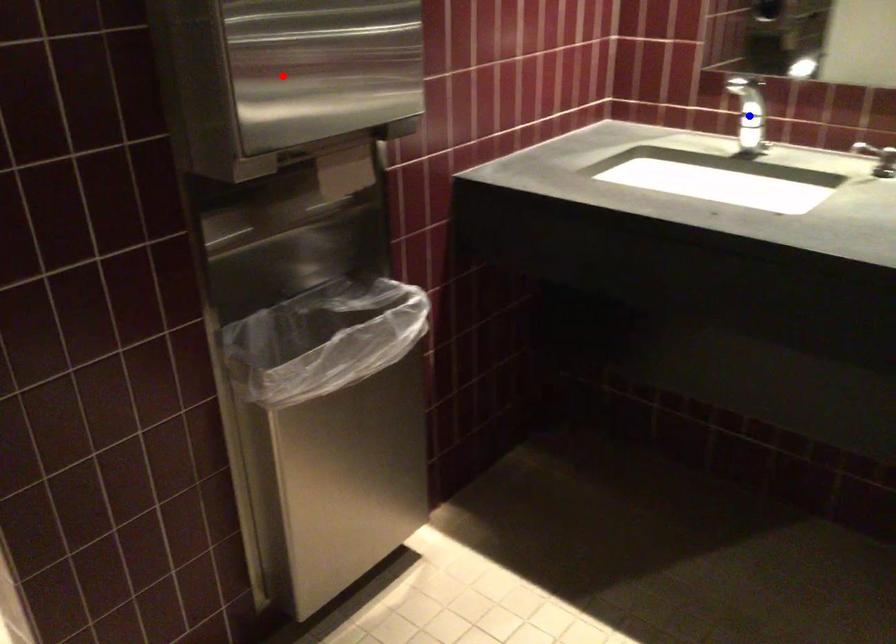
Question: In the image, two points are highlighted. Which point is nearer to the camera? Reply with the corresponding letter.

Choices:
 (A) blue point
 (B) red point

Answer: (B)